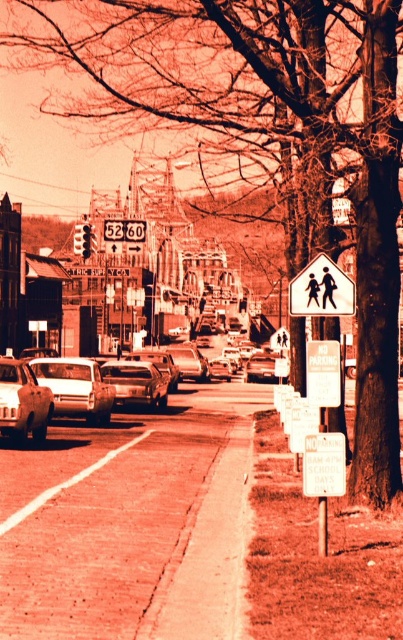
Question: Which point appears closest to the camera in this image?

Choices:
 (A) (95, 420)
 (B) (149, 388)

Answer: (A)

Question: Among these objects, which one is farthest from the camera?

Choices:
 (A) matte silver sedan at center-left
 (B) matte white car at center

Answer: (B)

Question: Does matte white car at center have a smaller size compared to matte silver sedan at center-left?

Choices:
 (A) yes
 (B) no

Answer: (B)

Question: Does matte white car at center have a larger size compared to matte silver sedan at center?

Choices:
 (A) no
 (B) yes

Answer: (B)

Question: Which point is closer to the camera?

Choices:
 (A) white plastic pedestrian crossing sign at center
 (B) matte silver sedan at center-left
 (C) matte white car at center

Answer: (A)

Question: Considering the relative positions of matte white car at center and white plastic pedestrian crossing sign at center in the image provided, where is matte white car at center located with respect to white plastic pedestrian crossing sign at center?

Choices:
 (A) left
 (B) right

Answer: (A)